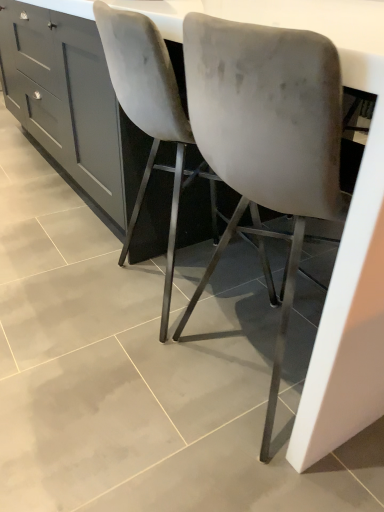
Locate an element on the screen. The width and height of the screenshot is (384, 512). velvet grey chair at center, which ranks as the first chair in right-to-left order is located at coordinates (268, 132).

Where is `velvet-like gray chair at center, which ranks as the 2th chair in right-to-left order`? velvet-like gray chair at center, which ranks as the 2th chair in right-to-left order is located at coordinates (155, 120).

The height and width of the screenshot is (512, 384). What are the coordinates of `matte gray cabinet at center` in the screenshot? It's located at coord(64,96).

Where is `velvet grey chair at center, which is the second chair from left to right`? The width and height of the screenshot is (384, 512). velvet grey chair at center, which is the second chair from left to right is located at coordinates (268, 132).

Is velvet-like gray chair at center, which ranks as the 2th chair in right-to-left order, at the back of velvet grey chair at center, which ranks as the first chair in right-to-left order?

That's not correct — velvet grey chair at center, which ranks as the first chair in right-to-left order, is not looking away from velvet-like gray chair at center, which ranks as the 2th chair in right-to-left order.

In the image, there is a velvet-like gray chair at center, which ranks as the 2th chair in right-to-left order. Identify the location of chair below it (from a real-world perspective). The image size is (384, 512). (268, 132).

Between velvet grey chair at center, which is the second chair from left to right, and velvet-like gray chair at center, the 1th chair when ordered from left to right, which one is positioned behind?

velvet-like gray chair at center, the 1th chair when ordered from left to right, is behind.

Is velvet grey chair at center, which ranks as the first chair in right-to-left order, surrounding velvet-like gray chair at center, the 1th chair when ordered from left to right?

No, velvet-like gray chair at center, the 1th chair when ordered from left to right, is located outside of velvet grey chair at center, which ranks as the first chair in right-to-left order.

From a real-world perspective, is matte gray cabinet at center physically located above or below white glossy counter at center?

Clearly, from a real-world perspective, matte gray cabinet at center is below white glossy counter at center.

Considering the sizes of objects matte gray cabinet at center and white glossy counter at center in the image provided, who is bigger, matte gray cabinet at center or white glossy counter at center?

white glossy counter at center is bigger.

Would you say matte gray cabinet at center is a long distance from white glossy counter at center?

Indeed, matte gray cabinet at center is not near white glossy counter at center.

Considering their positions, is matte gray cabinet at center located in front of or behind white glossy counter at center?

matte gray cabinet at center is behind white glossy counter at center.

Which is more to the right, matte gray cabinet at center or velvet-like gray chair at center, which ranks as the 2th chair in right-to-left order?

From the viewer's perspective, velvet-like gray chair at center, which ranks as the 2th chair in right-to-left order, appears more on the right side.

Measure the distance from matte gray cabinet at center to velvet-like gray chair at center, the 1th chair when ordered from left to right.

matte gray cabinet at center is 25.27 inches from velvet-like gray chair at center, the 1th chair when ordered from left to right.

Does matte gray cabinet at center have a smaller size compared to velvet-like gray chair at center, which ranks as the 2th chair in right-to-left order?

No.

Is there a large distance between matte gray cabinet at center and velvet-like gray chair at center, the 1th chair when ordered from left to right?

No, there isn't a large distance between matte gray cabinet at center and velvet-like gray chair at center, the 1th chair when ordered from left to right.

Which of these two, velvet grey chair at center, which ranks as the first chair in right-to-left order, or white glossy counter at center, is thinner?

velvet grey chair at center, which ranks as the first chair in right-to-left order, is thinner.

Considering the sizes of velvet grey chair at center, which ranks as the first chair in right-to-left order, and white glossy counter at center in the image, is velvet grey chair at center, which ranks as the first chair in right-to-left order, bigger or smaller than white glossy counter at center?

Considering their sizes, velvet grey chair at center, which ranks as the first chair in right-to-left order, takes up less space than white glossy counter at center.

Which object is positioned more to the left, velvet grey chair at center, which ranks as the first chair in right-to-left order, or white glossy counter at center?

Positioned to the left is white glossy counter at center.

From a real-world perspective, who is located higher, velvet grey chair at center, which ranks as the first chair in right-to-left order, or white glossy counter at center?

From a 3D spatial view, velvet grey chair at center, which ranks as the first chair in right-to-left order, is above.

In the image, is white glossy counter at center on the left side or the right side of velvet-like gray chair at center, which ranks as the 2th chair in right-to-left order?

white glossy counter at center is to the right of velvet-like gray chair at center, which ranks as the 2th chair in right-to-left order.

From the picture: Can you confirm if white glossy counter at center is wider than velvet-like gray chair at center, the 1th chair when ordered from left to right?

Yes.

Between white glossy counter at center and velvet-like gray chair at center, which ranks as the 2th chair in right-to-left order, which one is positioned in front?

white glossy counter at center is more forward.

How different are the orientations of white glossy counter at center and velvet-like gray chair at center, the 1th chair when ordered from left to right, in degrees?

white glossy counter at center and velvet-like gray chair at center, the 1th chair when ordered from left to right, are facing 92.1 degrees away from each other.

Looking at this image, from the image's perspective, would you say matte gray cabinet at center is shown under velvet grey chair at center, which is the second chair from left to right?

No, from the image's perspective, matte gray cabinet at center is not beneath velvet grey chair at center, which is the second chair from left to right.

Does point (102, 65) lie behind point (279, 106)?

Yes, point (102, 65) is farther from viewer.

Identify the location of the 2nd chair counting from the right side of the matte gray cabinet at center. The image size is (384, 512). (268, 132).

Can you tell me how much matte gray cabinet at center and velvet grey chair at center, which is the second chair from left to right, differ in facing direction?

The facing directions of matte gray cabinet at center and velvet grey chair at center, which is the second chair from left to right, are 0.291 degrees apart.

Considering the relative sizes of velvet grey chair at center, which is the second chair from left to right, and matte gray cabinet at center in the image provided, is velvet grey chair at center, which is the second chair from left to right, thinner than matte gray cabinet at center?

Yes, velvet grey chair at center, which is the second chair from left to right, is thinner than matte gray cabinet at center.

Is the surface of velvet grey chair at center, which ranks as the first chair in right-to-left order, in direct contact with matte gray cabinet at center?

velvet grey chair at center, which ranks as the first chair in right-to-left order, and matte gray cabinet at center are clearly separated.

Is velvet grey chair at center, which is the second chair from left to right, surrounding matte gray cabinet at center?

No, matte gray cabinet at center is not surrounded by velvet grey chair at center, which is the second chair from left to right.

Based on the photo, is the depth of velvet grey chair at center, which is the second chair from left to right, less than that of matte gray cabinet at center?

Yes, velvet grey chair at center, which is the second chair from left to right, is in front of matte gray cabinet at center.

Identify the location of chair above the velvet grey chair at center, which ranks as the first chair in right-to-left order (from the image's perspective). (155, 120).

Identify the location of cabinetry lying on the left of white glossy counter at center. (64, 96).

Estimate the real-world distances between objects in this image. Which object is further from white glossy counter at center, matte gray cabinet at center or velvet-like gray chair at center, the 1th chair when ordered from left to right?

matte gray cabinet at center is further to white glossy counter at center.

Which object lies further to the anchor point white glossy counter at center, velvet grey chair at center, which is the second chair from left to right, or velvet-like gray chair at center, the 1th chair when ordered from left to right?

velvet-like gray chair at center, the 1th chair when ordered from left to right.

When comparing their distances from matte gray cabinet at center, does white glossy counter at center or velvet grey chair at center, which is the second chair from left to right, seem closer?

Based on the image, white glossy counter at center appears to be nearer to matte gray cabinet at center.

Considering their positions, is velvet grey chair at center, which ranks as the first chair in right-to-left order, positioned further to velvet-like gray chair at center, the 1th chair when ordered from left to right, than matte gray cabinet at center?

matte gray cabinet at center.

Looking at the image, which one is located further to matte gray cabinet at center, velvet-like gray chair at center, which ranks as the 2th chair in right-to-left order, or velvet grey chair at center, which is the second chair from left to right?

Based on the image, velvet grey chair at center, which is the second chair from left to right, appears to be further to matte gray cabinet at center.

Based on their spatial positions, is velvet-like gray chair at center, the 1th chair when ordered from left to right, or matte gray cabinet at center closer to white glossy counter at center?

velvet-like gray chair at center, the 1th chair when ordered from left to right, is closer to white glossy counter at center.

Estimate the real-world distances between objects in this image. Which object is further from matte gray cabinet at center, velvet grey chair at center, which is the second chair from left to right, or white glossy counter at center?

The object further to matte gray cabinet at center is velvet grey chair at center, which is the second chair from left to right.

Which object lies nearer to the anchor point white glossy counter at center, matte gray cabinet at center or velvet grey chair at center, which ranks as the first chair in right-to-left order?

Based on the image, velvet grey chair at center, which ranks as the first chair in right-to-left order, appears to be nearer to white glossy counter at center.

The width and height of the screenshot is (384, 512). In order to click on chair located between matte gray cabinet at center and white glossy counter at center in the left-right direction in this screenshot , I will do `click(155, 120)`.

The height and width of the screenshot is (512, 384). What are the coordinates of `chair situated between matte gray cabinet at center and velvet grey chair at center, which ranks as the first chair in right-to-left order, from left to right` in the screenshot? It's located at (155, 120).

This screenshot has height=512, width=384. In order to click on chair between white glossy counter at center and velvet grey chair at center, which is the second chair from left to right, in the vertical direction in this screenshot , I will do `click(155, 120)`.

I want to click on counter between matte gray cabinet at center and velvet grey chair at center, which ranks as the first chair in right-to-left order, so click(340, 61).